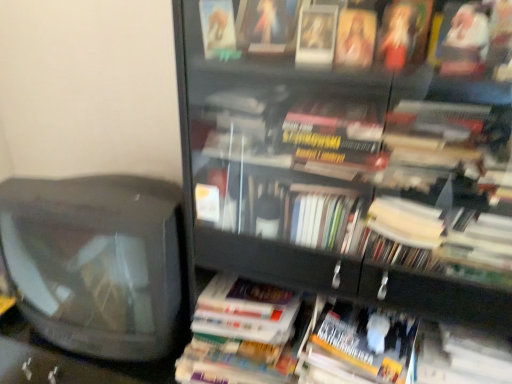
Image resolution: width=512 pixels, height=384 pixels. What are the coordinates of `transparent glass bookcase at center` in the screenshot? It's located at (347, 151).

Identify the location of yellow matte paperback book at lower right, which is the 2th paperback book from left to right. The image size is (512, 384). (362, 345).

Based on the photo, considering the sizes of objects transparent glass bookcase at center and yellow matte paperback book at lower right, which appears as the first paperback book when viewed from the right, in the image provided, who is wider, transparent glass bookcase at center or yellow matte paperback book at lower right, which appears as the first paperback book when viewed from the right,?

With larger width is transparent glass bookcase at center.

Considering the points (285, 217) and (392, 383), which point is behind, point (285, 217) or point (392, 383)?

The point (285, 217) is farther.

Is transparent glass bookcase at center taller than yellow matte paperback book at lower right, which appears as the first paperback book when viewed from the right?

Indeed, transparent glass bookcase at center has a greater height compared to yellow matte paperback book at lower right, which appears as the first paperback book when viewed from the right.

How many degrees apart are the facing directions of transparent glass bookcase at center and yellow matte paperback book at lower right, which appears as the first paperback book when viewed from the right?

The angular difference between transparent glass bookcase at center and yellow matte paperback book at lower right, which appears as the first paperback book when viewed from the right, is 1.58 degrees.

From a real-world perspective, is hardcover book at center, arranged as the 2th paperback book when viewed from the right, positioned above or below yellow matte paperback book at lower right, which appears as the first paperback book when viewed from the right?

From a real-world perspective, hardcover book at center, arranged as the 2th paperback book when viewed from the right, is physically above yellow matte paperback book at lower right, which appears as the first paperback book when viewed from the right.

Can you confirm if hardcover book at center, arranged as the 2th paperback book when viewed from the right, is bigger than yellow matte paperback book at lower right, which appears as the first paperback book when viewed from the right?

Yes.

Is point (248, 284) more distant than point (367, 356)?

Yes, it is.

Considering the sizes of objects hardcover book at center, arranged as the 2th paperback book when viewed from the right, and yellow matte paperback book at lower right, which appears as the first paperback book when viewed from the right, in the image provided, who is shorter, hardcover book at center, arranged as the 2th paperback book when viewed from the right, or yellow matte paperback book at lower right, which appears as the first paperback book when viewed from the right,?

Standing shorter between the two is hardcover book at center, arranged as the 2th paperback book when viewed from the right.

Considering the relative sizes of transparent glass bookcase at center and hardcover book at center, arranged as the 2th paperback book when viewed from the right, in the image provided, is transparent glass bookcase at center wider than hardcover book at center, arranged as the 2th paperback book when viewed from the right,?

Yes, transparent glass bookcase at center is wider than hardcover book at center, arranged as the 2th paperback book when viewed from the right.

Which of these two, transparent glass bookcase at center or hardcover book at center, positioned as the 1th paperback book in left-to-right order, stands taller?

transparent glass bookcase at center is taller.

Is point (496, 266) positioned in front of point (205, 310)?

Yes, it is in front of point (205, 310).

Considering the sizes of objects transparent glass bookcase at center and hardcover book at center, positioned as the 1th paperback book in left-to-right order, in the image provided, who is bigger, transparent glass bookcase at center or hardcover book at center, positioned as the 1th paperback book in left-to-right order,?

transparent glass bookcase at center.

Consider the image. Is hardcover book at center, arranged as the 2th paperback book when viewed from the right, positioned far away from transparent glass bookcase at center?

No.

From the image's perspective, count 1st paperback books downward from the transparent glass bookcase at center and point to it. Please provide its 2D coordinates.

[(244, 334)]

Is hardcover book at center, positioned as the 1th paperback book in left-to-right order, at the left side of transparent glass bookcase at center?

In fact, hardcover book at center, positioned as the 1th paperback book in left-to-right order, is to the right of transparent glass bookcase at center.

From the image's perspective, is hardcover book at center, arranged as the 2th paperback book when viewed from the right, located above or below transparent glass bookcase at center?

Clearly, from the image's perspective, hardcover book at center, arranged as the 2th paperback book when viewed from the right, is below transparent glass bookcase at center.

Does yellow matte paperback book at lower right, which appears as the first paperback book when viewed from the right, have a smaller size compared to hardcover book at center, arranged as the 2th paperback book when viewed from the right?

Yes.

From the image's perspective, does yellow matte paperback book at lower right, which appears as the first paperback book when viewed from the right, appear lower than hardcover book at center, positioned as the 1th paperback book in left-to-right order?

Yes.

Can you confirm if yellow matte paperback book at lower right, which is the 2th paperback book from left to right, is shorter than hardcover book at center, arranged as the 2th paperback book when viewed from the right?

No.

Is yellow matte paperback book at lower right, which appears as the first paperback book when viewed from the right, inside the boundaries of hardcover book at center, arranged as the 2th paperback book when viewed from the right, or outside?

yellow matte paperback book at lower right, which appears as the first paperback book when viewed from the right, is spatially situated outside hardcover book at center, arranged as the 2th paperback book when viewed from the right.

Is the depth of yellow matte paperback book at lower right, which is the 2th paperback book from left to right, less than that of transparent glass bookcase at center?

No, the depth of yellow matte paperback book at lower right, which is the 2th paperback book from left to right, is greater than that of transparent glass bookcase at center.

Looking at this image, is transparent glass bookcase at center at the back of yellow matte paperback book at lower right, which appears as the first paperback book when viewed from the right?

Yes, transparent glass bookcase at center is at the back of yellow matte paperback book at lower right, which appears as the first paperback book when viewed from the right.

In terms of height, does yellow matte paperback book at lower right, which appears as the first paperback book when viewed from the right, look taller or shorter compared to transparent glass bookcase at center?

Clearly, yellow matte paperback book at lower right, which appears as the first paperback book when viewed from the right, is shorter compared to transparent glass bookcase at center.

Does point (404, 375) appear closer or farther from the camera than point (291, 5)?

Point (404, 375) is positioned farther from the camera compared to point (291, 5).

The height and width of the screenshot is (384, 512). In order to click on paperback book that is the 2nd one below the transparent glass bookcase at center (from a real-world perspective) in this screenshot , I will do pos(362,345).

You are a GUI agent. You are given a task and a screenshot of the screen. Output one action in this format:
    pyautogui.click(x=<x>, y=<y>)
    Task: Click on the paperback book located above the yellow matte paperback book at lower right, which appears as the first paperback book when viewed from the right (from a real-world perspective)
    The width and height of the screenshot is (512, 384).
    Given the screenshot: What is the action you would take?
    pyautogui.click(x=244, y=334)

Based on their spatial positions, is yellow matte paperback book at lower right, which appears as the first paperback book when viewed from the right, or hardcover book at center, arranged as the 2th paperback book when viewed from the right, further from transparent glass bookcase at center?

Among the two, hardcover book at center, arranged as the 2th paperback book when viewed from the right, is located further to transparent glass bookcase at center.

Looking at the image, which one is located further to yellow matte paperback book at lower right, which is the 2th paperback book from left to right, hardcover book at center, positioned as the 1th paperback book in left-to-right order, or transparent glass bookcase at center?

Based on the image, transparent glass bookcase at center appears to be further to yellow matte paperback book at lower right, which is the 2th paperback book from left to right.

Estimate the real-world distances between objects in this image. Which object is closer to yellow matte paperback book at lower right, which appears as the first paperback book when viewed from the right, transparent glass bookcase at center or hardcover book at center, positioned as the 1th paperback book in left-to-right order?

hardcover book at center, positioned as the 1th paperback book in left-to-right order, is positioned closer to the anchor yellow matte paperback book at lower right, which appears as the first paperback book when viewed from the right.

Estimate the real-world distances between objects in this image. Which object is further from hardcover book at center, arranged as the 2th paperback book when viewed from the right, transparent glass bookcase at center or yellow matte paperback book at lower right, which is the 2th paperback book from left to right?

transparent glass bookcase at center is further to hardcover book at center, arranged as the 2th paperback book when viewed from the right.

Considering their positions, is hardcover book at center, arranged as the 2th paperback book when viewed from the right, positioned closer to transparent glass bookcase at center than yellow matte paperback book at lower right, which is the 2th paperback book from left to right?

yellow matte paperback book at lower right, which is the 2th paperback book from left to right, lies closer to transparent glass bookcase at center than the other object.

From the image, which object appears to be nearer to hardcover book at center, positioned as the 1th paperback book in left-to-right order, yellow matte paperback book at lower right, which appears as the first paperback book when viewed from the right, or transparent glass bookcase at center?

Among the two, yellow matte paperback book at lower right, which appears as the first paperback book when viewed from the right, is located nearer to hardcover book at center, positioned as the 1th paperback book in left-to-right order.

At what (x,y) coordinates should I click in order to perform the action: click on paperback book between transparent glass bookcase at center and hardcover book at center, arranged as the 2th paperback book when viewed from the right, along the z-axis. Please return your answer as a coordinate pair (x, y). The height and width of the screenshot is (384, 512). Looking at the image, I should click on (362, 345).